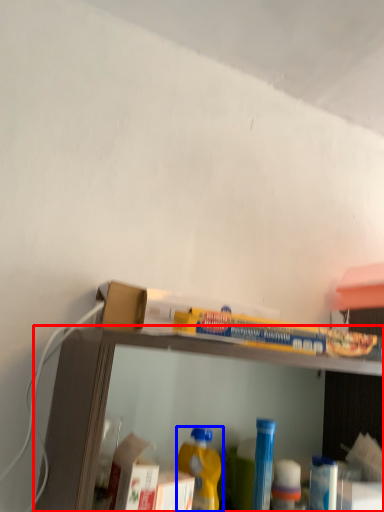
Question: Among these objects, which one is nearest to the camera, shelf (highlighted by a red box) or bottle (highlighted by a blue box)?

Choices:
 (A) shelf
 (B) bottle

Answer: (A)